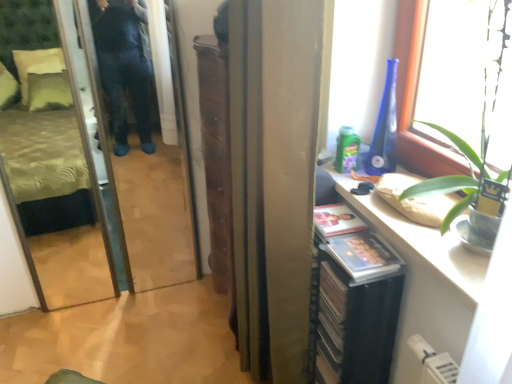
Question: Can you confirm if transparent glass screen door at left is positioned to the right of satin gold curtain at center?

Choices:
 (A) yes
 (B) no

Answer: (B)

Question: Can you confirm if transparent glass screen door at left is taller than satin gold curtain at center?

Choices:
 (A) yes
 (B) no

Answer: (A)

Question: From a real-world perspective, is transparent glass screen door at left over satin gold curtain at center?

Choices:
 (A) no
 (B) yes

Answer: (A)

Question: Does transparent glass screen door at left lie behind satin gold curtain at center?

Choices:
 (A) no
 (B) yes

Answer: (B)

Question: Can you confirm if transparent glass screen door at left is wider than satin gold curtain at center?

Choices:
 (A) yes
 (B) no

Answer: (B)

Question: Relative to satin gold curtain at center, is transparent glass window at upper right in front or behind?

Choices:
 (A) behind
 (B) front

Answer: (B)

Question: From a real-world perspective, is transparent glass window at upper right above or below satin gold curtain at center?

Choices:
 (A) below
 (B) above

Answer: (B)

Question: Is transparent glass window at upper right spatially inside satin gold curtain at center, or outside of it?

Choices:
 (A) inside
 (B) outside

Answer: (B)

Question: From the image's perspective, relative to satin gold curtain at center, is transparent glass window at upper right above or below?

Choices:
 (A) below
 (B) above

Answer: (B)

Question: From a real-world perspective, is satin gold curtain at center above or below transparent glass window at upper right?

Choices:
 (A) below
 (B) above

Answer: (A)

Question: Based on their positions, is satin gold curtain at center located to the left or right of transparent glass window at upper right?

Choices:
 (A) left
 (B) right

Answer: (A)

Question: From the image's perspective, is satin gold curtain at center positioned above or below transparent glass window at upper right?

Choices:
 (A) below
 (B) above

Answer: (A)

Question: Is satin gold curtain at center bigger or smaller than transparent glass window at upper right?

Choices:
 (A) small
 (B) big

Answer: (B)

Question: From the image's perspective, is transparent glass screen door at left above or below satin gold curtain at center?

Choices:
 (A) above
 (B) below

Answer: (A)

Question: Is transparent glass screen door at left spatially inside satin gold curtain at center, or outside of it?

Choices:
 (A) outside
 (B) inside

Answer: (A)